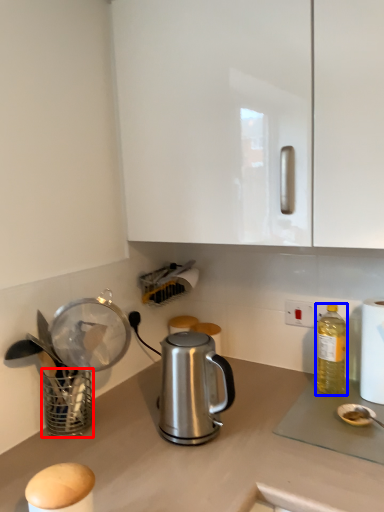
Question: Which of the following is the farthest to the observer, basket (highlighted by a red box) or bottle (highlighted by a blue box)?

Choices:
 (A) basket
 (B) bottle

Answer: (B)